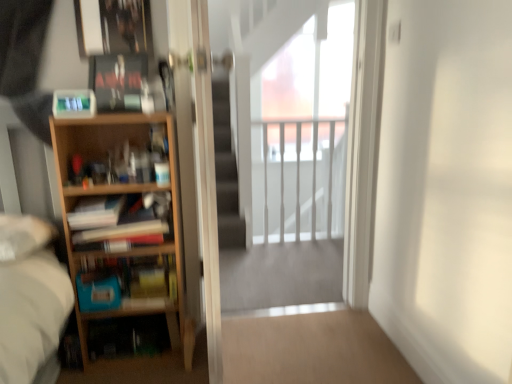
Identify the location of free spot to the right of matte black book at upper left. [114, 114].